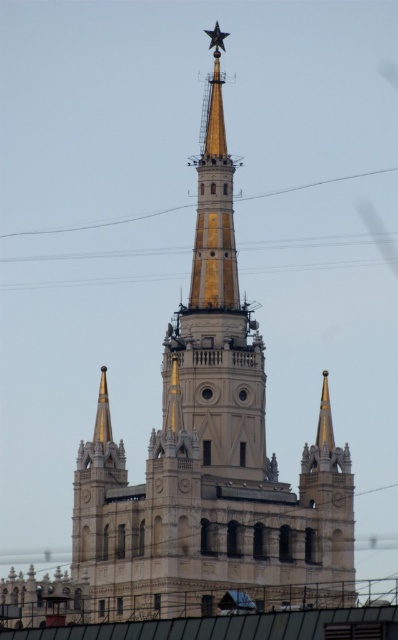
Is point (210, 106) farther from camera compared to point (220, 36)?

No, (210, 106) is in front of (220, 36).

This screenshot has width=398, height=640. What are the coordinates of `gold polished metal spire at center` in the screenshot? It's located at pyautogui.click(x=216, y=326).

Who is shorter, yellow metallic power line at upper center or metallic gold star at upper center?

With less height is metallic gold star at upper center.

Is yellow metallic power line at upper center below metallic gold star at upper center?

Correct, yellow metallic power line at upper center is located below metallic gold star at upper center.

Is point (183, 205) more distant than point (210, 49)?

No.

Where is `yellow metallic power line at upper center`? This screenshot has width=398, height=640. yellow metallic power line at upper center is located at coordinates (95, 224).

Which is behind, point (187, 349) or point (327, 184)?

Point (327, 184)

Does gold polished metal spire at center have a smaller size compared to yellow metallic power line at upper center?

Actually, gold polished metal spire at center might be larger than yellow metallic power line at upper center.

The height and width of the screenshot is (640, 398). What do you see at coordinates (216, 326) in the screenshot?
I see `gold polished metal spire at center` at bounding box center [216, 326].

The width and height of the screenshot is (398, 640). In order to click on gold polished metal spire at center in this screenshot , I will do `click(216, 326)`.